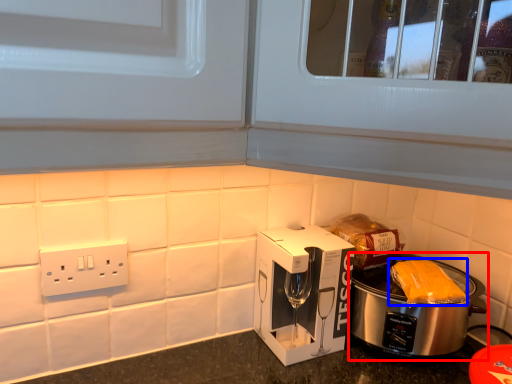
Question: Among these objects, which one is farthest to the camera, slow cooker (highlighted by a red box) or food (highlighted by a blue box)?

Choices:
 (A) slow cooker
 (B) food

Answer: (B)